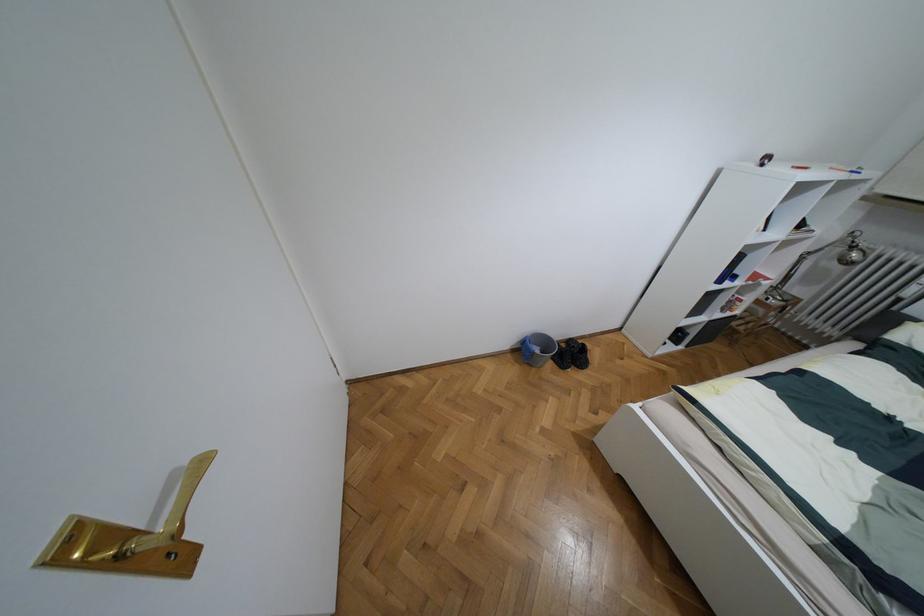
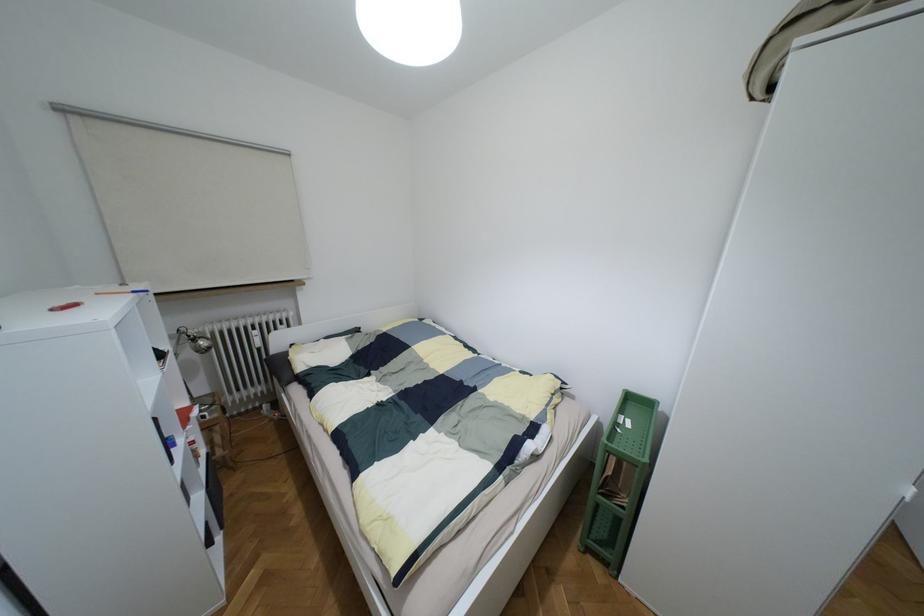
First-person continuous shooting, in which direction is the camera rotating?

The camera's rotation is toward right-down.